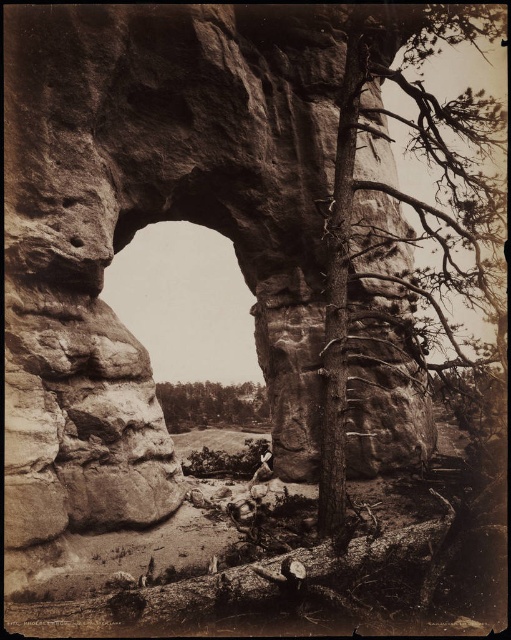
Which is below, smooth brown log at lower center or green leafy tree at center?

green leafy tree at center is below.

Does smooth brown log at lower center appear under green leafy tree at center?

Actually, smooth brown log at lower center is above green leafy tree at center.

Locate an element on the screen. Image resolution: width=511 pixels, height=640 pixels. smooth brown log at lower center is located at coordinates (229, 582).